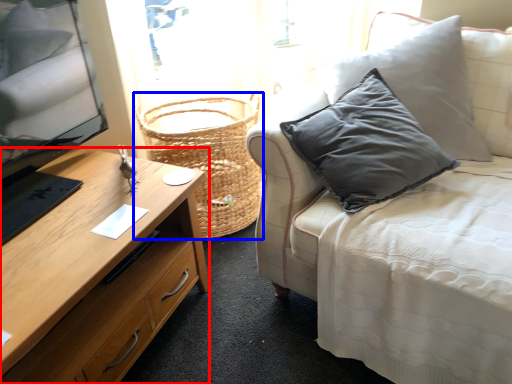
Question: Among these objects, which one is farthest to the camera, desk (highlighted by a red box) or basket (highlighted by a blue box)?

Choices:
 (A) desk
 (B) basket

Answer: (B)